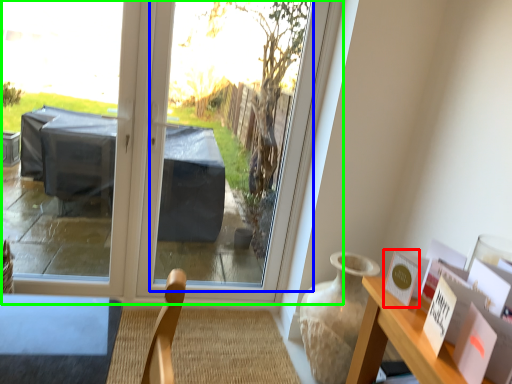
Question: Which object is positioned closest to postcard (highlighted by a red box)? Select from window screen (highlighted by a blue box) and window (highlighted by a green box).

Choices:
 (A) window screen
 (B) window

Answer: (B)